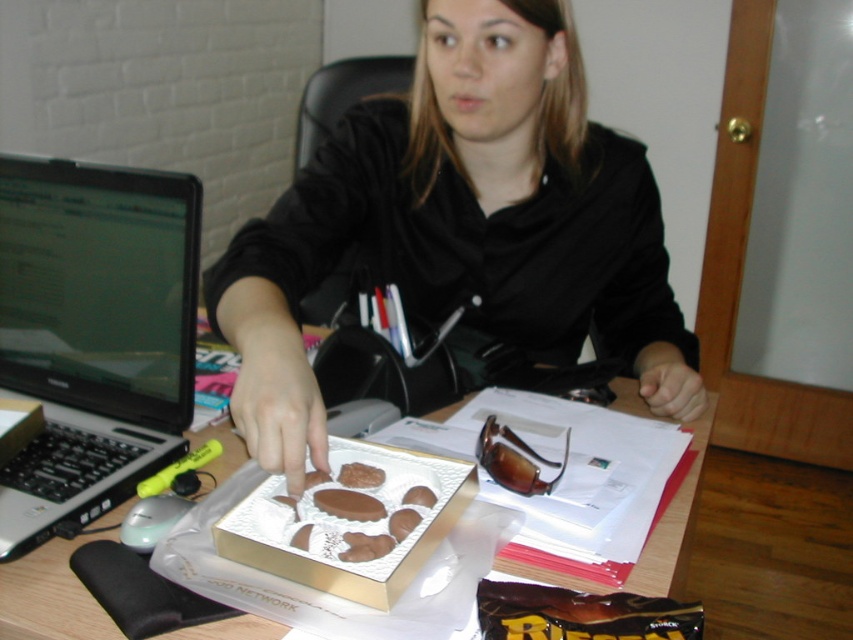
Looking at this image, you are an office assistant who needs to determine if the black matte shirt at center can be placed on the wooden table at center without covering the laptop. Based on their sizes, is this possible?

The black matte shirt at center is larger in size than wooden table at center, so placing it would likely cover the laptop.

What are the coordinates of the black matte shirt at center?

The black matte shirt at center is located at point (462, 225).